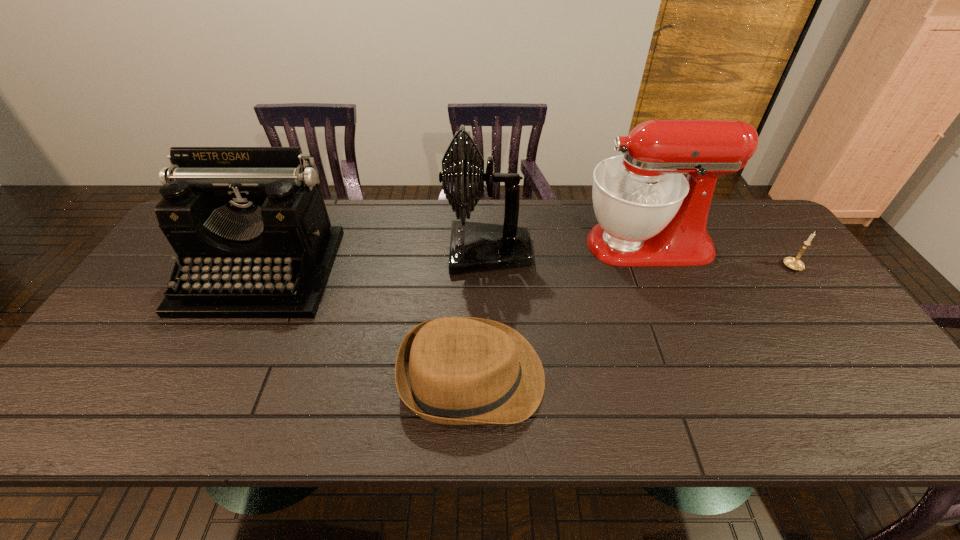
Find the location of a particular element. Image resolution: width=960 pixels, height=540 pixels. vacant space located 0.060m in front of the fan to blow air is located at coordinates (424, 251).

You are a GUI agent. You are given a task and a screenshot of the screen. Output one action in this format:
    pyautogui.click(x=<x>, y=<y>)
    Task: Click on the vacant area located in front of the fan to blow air
    This screenshot has width=960, height=540.
    Given the screenshot: What is the action you would take?
    pyautogui.click(x=311, y=251)

Where is `free space located on the typing side of the typewriter`? This screenshot has width=960, height=540. free space located on the typing side of the typewriter is located at coordinates (193, 407).

I want to click on free region located on the handle side of the rightmost object, so click(x=815, y=298).

The width and height of the screenshot is (960, 540). Find the location of `vacant point located 0.260m on the front-facing side of the nearest object`. vacant point located 0.260m on the front-facing side of the nearest object is located at coordinates (658, 376).

Find the location of a particular element. The width and height of the screenshot is (960, 540). mixer situated at the far edge is located at coordinates (649, 214).

I want to click on fan at the far edge, so click(474, 246).

The width and height of the screenshot is (960, 540). In order to click on typewriter present at the far edge in this screenshot , I will do [x=249, y=225].

Locate an element on the screen. object that is positioned at the near edge is located at coordinates (454, 370).

The width and height of the screenshot is (960, 540). I want to click on object positioned at the left edge, so click(x=249, y=225).